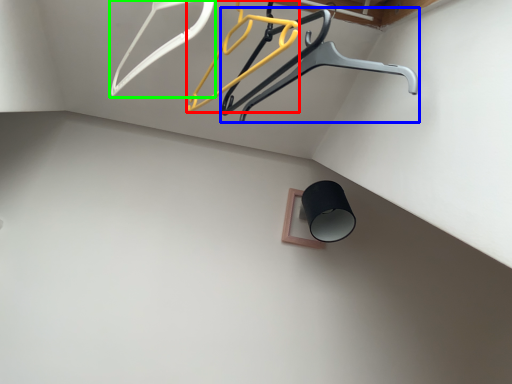
Question: Considering the real-world distances, which object is closest to hanger (highlighted by a red box)? furniture (highlighted by a blue box) or hanger (highlighted by a green box).

Choices:
 (A) furniture
 (B) hanger

Answer: (A)